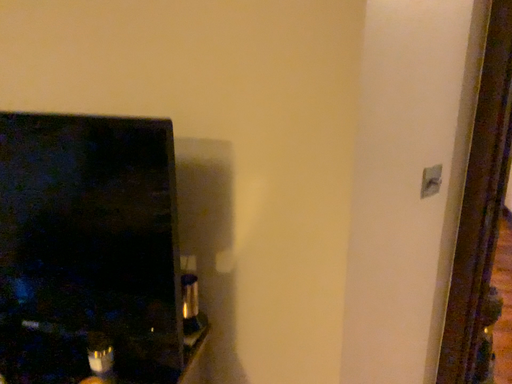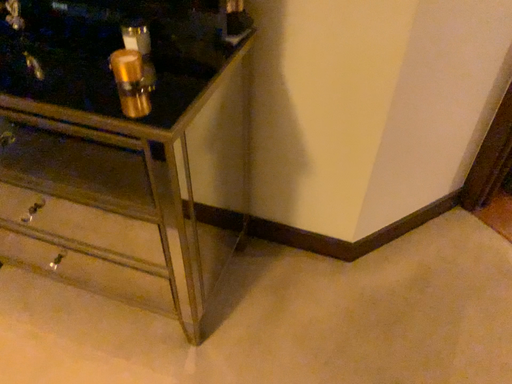
Question: How did the camera likely rotate when shooting the video?

Choices:
 (A) rotated upward
 (B) rotated downward

Answer: (B)